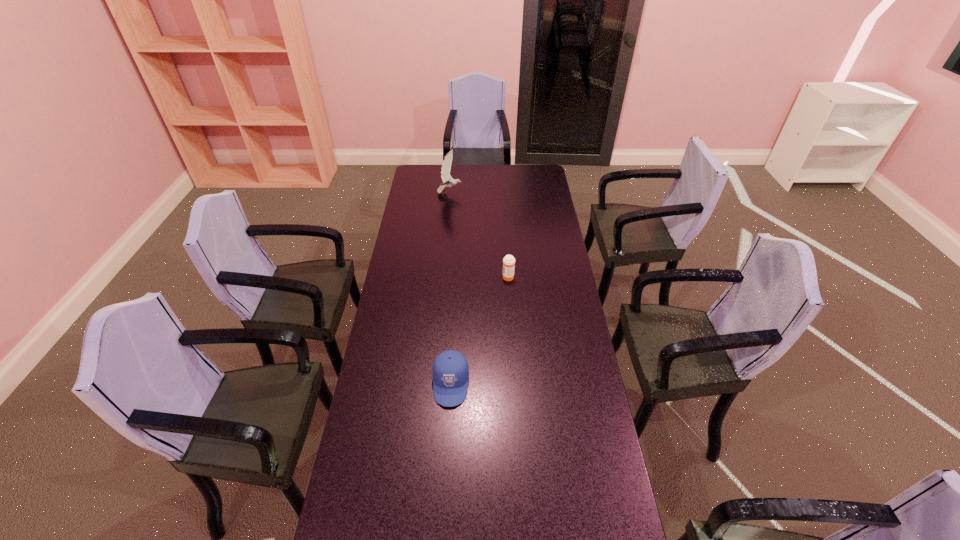
This screenshot has height=540, width=960. I want to click on object at the far left corner, so click(x=448, y=181).

Image resolution: width=960 pixels, height=540 pixels. I want to click on free region at the far edge of the desktop, so click(471, 173).

I want to click on free point at the left edge, so click(x=376, y=389).

Find the location of a particular element. The height and width of the screenshot is (540, 960). free region at the right edge of the desktop is located at coordinates click(x=573, y=505).

You are a GUI agent. You are given a task and a screenshot of the screen. Output one action in this format:
    pyautogui.click(x=<x>, y=<y>)
    Task: Click on the vacant point at the far left corner
    Image resolution: width=960 pixels, height=540 pixels.
    Given the screenshot: What is the action you would take?
    pyautogui.click(x=437, y=172)

I want to click on free spot at the far right corner of the desktop, so click(529, 172).

You are a GUI agent. You are given a task and a screenshot of the screen. Output one action in this format:
    pyautogui.click(x=<x>, y=<y>)
    Task: Click on the vacant area that lies between the tallest object and the rightmost object
    This screenshot has height=540, width=960.
    Given the screenshot: What is the action you would take?
    pyautogui.click(x=479, y=235)

This screenshot has width=960, height=540. What are the coordinates of `vacant point located between the nearest object and the medicine` in the screenshot? It's located at (479, 330).

The height and width of the screenshot is (540, 960). Find the location of `vacant space that's between the medicine and the cap`. vacant space that's between the medicine and the cap is located at coordinates (479, 330).

This screenshot has width=960, height=540. In order to click on vacant region between the medicine and the farthest object in this screenshot , I will do `click(479, 235)`.